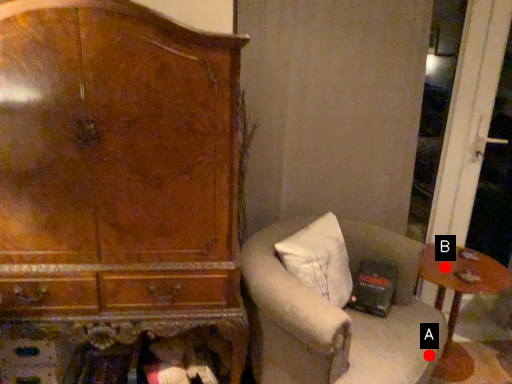
Question: Two points are circled on the image, labeled by A and B beside each circle. Which point is closer to the camera taking this photo?

Choices:
 (A) A is closer
 (B) B is closer

Answer: (A)